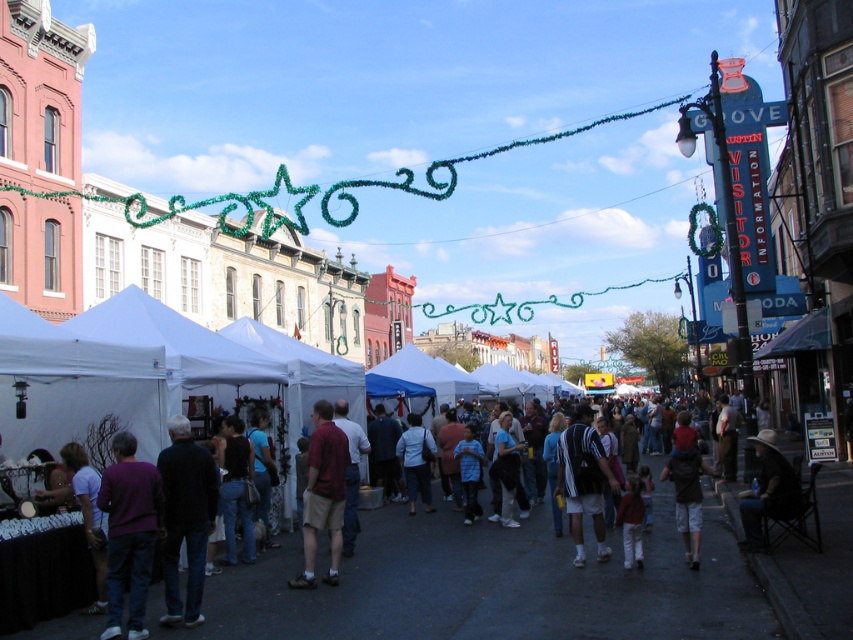
Is maroon shirt at center to the left of blue cotton shirt at center from the viewer's perspective?

Indeed, maroon shirt at center is positioned on the left side of blue cotton shirt at center.

Who is positioned more to the right, maroon shirt at center or blue cotton shirt at center?

Positioned to the right is blue cotton shirt at center.

Does point (341, 488) lie in front of point (508, 451)?

Yes, point (341, 488) is in front of point (508, 451).

Where is `maroon shirt at center`? The image size is (853, 640). maroon shirt at center is located at coordinates click(x=323, y=493).

Does point (186, 605) come in front of point (763, 444)?

Yes, it is.

Can you confirm if black cotton shirt at lower left is shorter than denim jacket at lower right?

No.

Image resolution: width=853 pixels, height=640 pixels. Describe the element at coordinates (184, 518) in the screenshot. I see `black cotton shirt at lower left` at that location.

Locate an element on the screen. Image resolution: width=853 pixels, height=640 pixels. black cotton shirt at lower left is located at coordinates (184, 518).

Does purple sweater at lower left have a greater width compared to denim jacket at lower right?

No, purple sweater at lower left is not wider than denim jacket at lower right.

Does point (123, 524) lie behind point (755, 442)?

No, (123, 524) is closer to viewer.

At what (x,y) coordinates should I click in order to perform the action: click on purple sweater at lower left. Please return your answer as a coordinate pair (x, y). The width and height of the screenshot is (853, 640). Looking at the image, I should click on (129, 532).